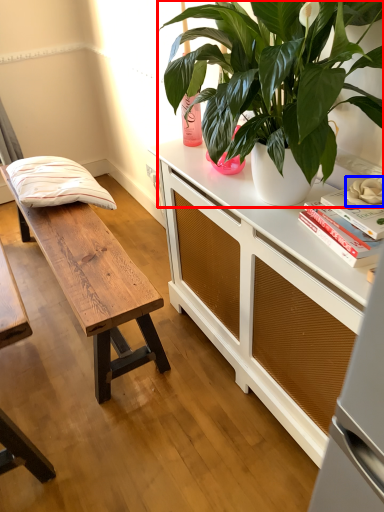
Question: Which of the following is the closest to the observer, houseplant (highlighted by a red box) or flower (highlighted by a blue box)?

Choices:
 (A) houseplant
 (B) flower

Answer: (A)